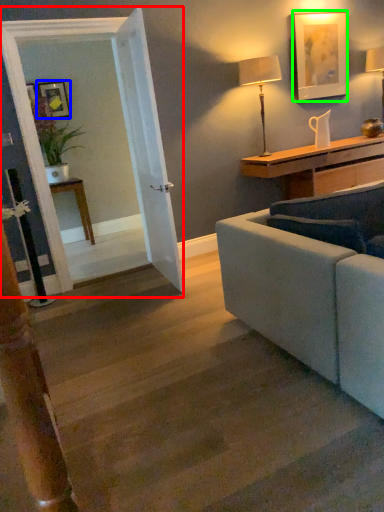
Question: Which is nearer to the glass door (highlighted by a red box)? picture frame (highlighted by a blue box) or picture frame (highlighted by a green box).

Choices:
 (A) picture frame
 (B) picture frame

Answer: (B)